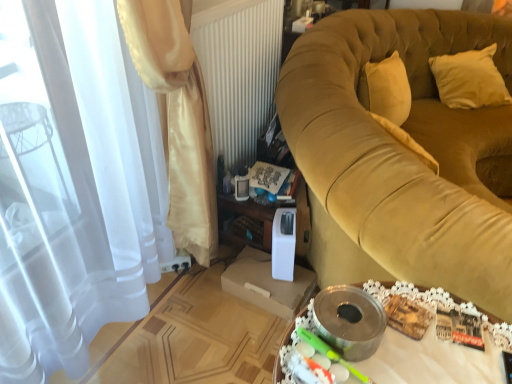
Question: From a real-world perspective, is satin curtain at left, which ranks as the 1th curtain in front-to-back order, located beneath velvet gold couch at right?

Choices:
 (A) no
 (B) yes

Answer: (A)

Question: Considering the relative positions of satin curtain at left, which ranks as the 1th curtain in front-to-back order, and velvet gold couch at right in the image provided, is satin curtain at left, which ranks as the 1th curtain in front-to-back order, behind velvet gold couch at right?

Choices:
 (A) yes
 (B) no

Answer: (A)

Question: Can you confirm if satin curtain at left, which ranks as the 1th curtain in front-to-back order, is smaller than velvet gold couch at right?

Choices:
 (A) no
 (B) yes

Answer: (B)

Question: Would you say velvet gold couch at right is part of satin curtain at left, the second curtain when ordered from back to front,'s contents?

Choices:
 (A) yes
 (B) no

Answer: (B)

Question: From a real-world perspective, is satin curtain at left, which ranks as the 1th curtain in front-to-back order, on velvet gold couch at right?

Choices:
 (A) no
 (B) yes

Answer: (B)

Question: Is satin curtain at left, the second curtain when ordered from back to front, wider than velvet gold couch at right?

Choices:
 (A) yes
 (B) no

Answer: (B)

Question: Is satin curtain at left, which appears as the 1th curtain when viewed from the back, shorter than metallic silver tray at lower center?

Choices:
 (A) yes
 (B) no

Answer: (B)

Question: Is satin curtain at left, which appears as the 1th curtain when viewed from the back, not near metallic silver tray at lower center?

Choices:
 (A) no
 (B) yes

Answer: (A)

Question: Can you confirm if satin curtain at left, the second curtain positioned from the front, is positioned to the left of metallic silver tray at lower center?

Choices:
 (A) yes
 (B) no

Answer: (A)

Question: Is satin curtain at left, the second curtain positioned from the front, positioned before metallic silver tray at lower center?

Choices:
 (A) yes
 (B) no

Answer: (B)

Question: From the image's perspective, would you say satin curtain at left, which appears as the 1th curtain when viewed from the back, is positioned over metallic silver tray at lower center?

Choices:
 (A) yes
 (B) no

Answer: (A)

Question: Is satin curtain at left, the second curtain positioned from the front, at the right side of metallic silver tray at lower center?

Choices:
 (A) yes
 (B) no

Answer: (B)

Question: Is metallic silver tray at lower center smaller than velvet gold couch at right?

Choices:
 (A) yes
 (B) no

Answer: (A)